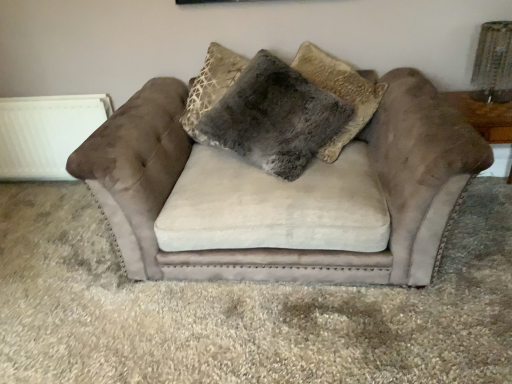
Question: Should I look upward or downward to see suede couch at center?

Choices:
 (A) up
 (B) down

Answer: (A)

Question: Can you confirm if fuzzy gray pillow at center is bigger than suede couch at center?

Choices:
 (A) yes
 (B) no

Answer: (B)

Question: Are fuzzy gray pillow at center and suede couch at center making contact?

Choices:
 (A) no
 (B) yes

Answer: (A)

Question: Considering the relative positions of fuzzy gray pillow at center and suede couch at center in the image provided, is fuzzy gray pillow at center behind suede couch at center?

Choices:
 (A) yes
 (B) no

Answer: (A)

Question: From the image's perspective, is fuzzy gray pillow at center above suede couch at center?

Choices:
 (A) no
 (B) yes

Answer: (B)

Question: Is fuzzy gray pillow at center positioned beyond the bounds of suede couch at center?

Choices:
 (A) no
 (B) yes

Answer: (A)

Question: Does fuzzy gray pillow at center contain suede couch at center?

Choices:
 (A) yes
 (B) no

Answer: (B)

Question: From the image's perspective, would you say suede couch at center is positioned over white matte radiator at left?

Choices:
 (A) yes
 (B) no

Answer: (B)

Question: Can you confirm if suede couch at center is thinner than white matte radiator at left?

Choices:
 (A) yes
 (B) no

Answer: (B)

Question: Considering the relative sizes of suede couch at center and white matte radiator at left in the image provided, is suede couch at center wider than white matte radiator at left?

Choices:
 (A) yes
 (B) no

Answer: (A)

Question: Does suede couch at center have a lesser height compared to white matte radiator at left?

Choices:
 (A) yes
 (B) no

Answer: (B)

Question: Does suede couch at center have a larger size compared to white matte radiator at left?

Choices:
 (A) no
 (B) yes

Answer: (B)

Question: From a real-world perspective, does suede couch at center stand above white matte radiator at left?

Choices:
 (A) no
 (B) yes

Answer: (B)

Question: Is white matte radiator at left a part of fuzzy gray pillow at center?

Choices:
 (A) no
 (B) yes

Answer: (A)